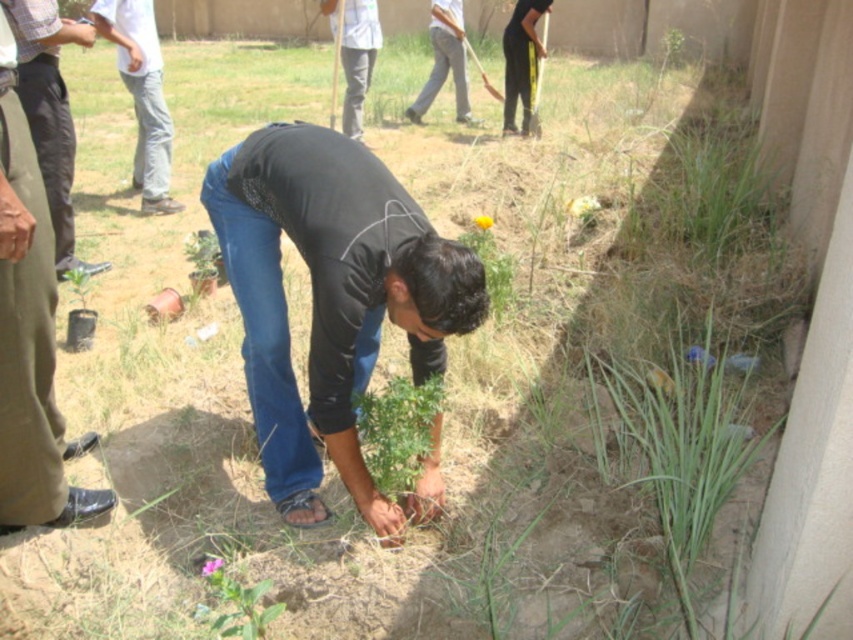
Can you confirm if pink matte flower at lower center is thinner than yellow matte flower at center?

Indeed, pink matte flower at lower center has a lesser width compared to yellow matte flower at center.

Can you confirm if pink matte flower at lower center is positioned to the right of yellow matte flower at center?

Incorrect, pink matte flower at lower center is not on the right side of yellow matte flower at center.

Image resolution: width=853 pixels, height=640 pixels. Describe the element at coordinates (212, 564) in the screenshot. I see `pink matte flower at lower center` at that location.

The image size is (853, 640). I want to click on pink matte flower at lower center, so click(212, 564).

Does black matte plant at center have a smaller size compared to yellow matte flower at center?

No.

Can you confirm if black matte plant at center is positioned to the right of yellow matte flower at center?

Incorrect, black matte plant at center is not on the right side of yellow matte flower at center.

What do you see at coordinates (331, 298) in the screenshot? Image resolution: width=853 pixels, height=640 pixels. I see `black matte plant at center` at bounding box center [331, 298].

Image resolution: width=853 pixels, height=640 pixels. I want to click on black matte plant at center, so click(x=331, y=298).

Does brown leather shoes at lower left have a lesser height compared to pink matte flower at lower center?

In fact, brown leather shoes at lower left may be taller than pink matte flower at lower center.

Image resolution: width=853 pixels, height=640 pixels. Identify the location of brown leather shoes at lower left. (28, 336).

Is point (36, 404) farther from viewer compared to point (216, 564)?

Yes.

Locate an element on the screen. This screenshot has height=640, width=853. brown leather shoes at lower left is located at coordinates (28, 336).